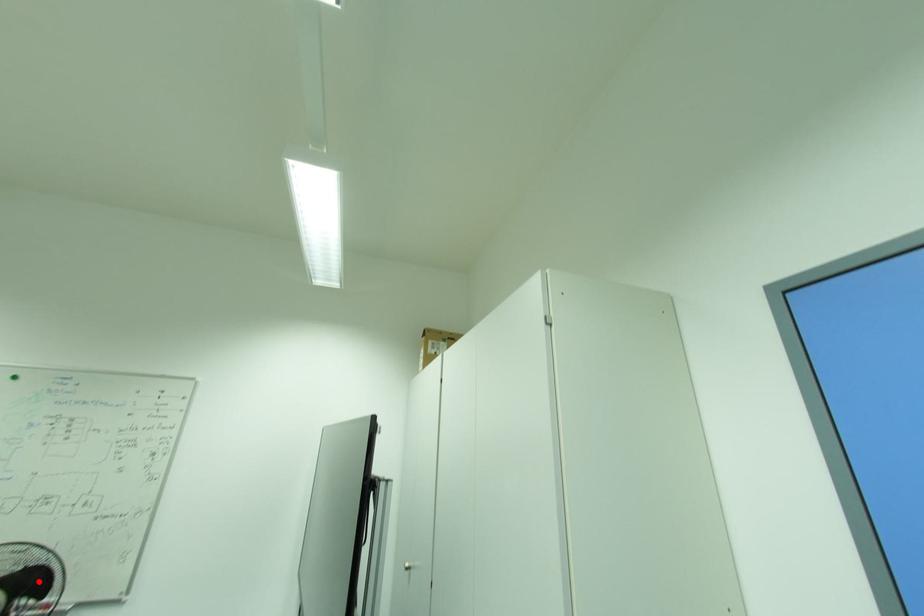
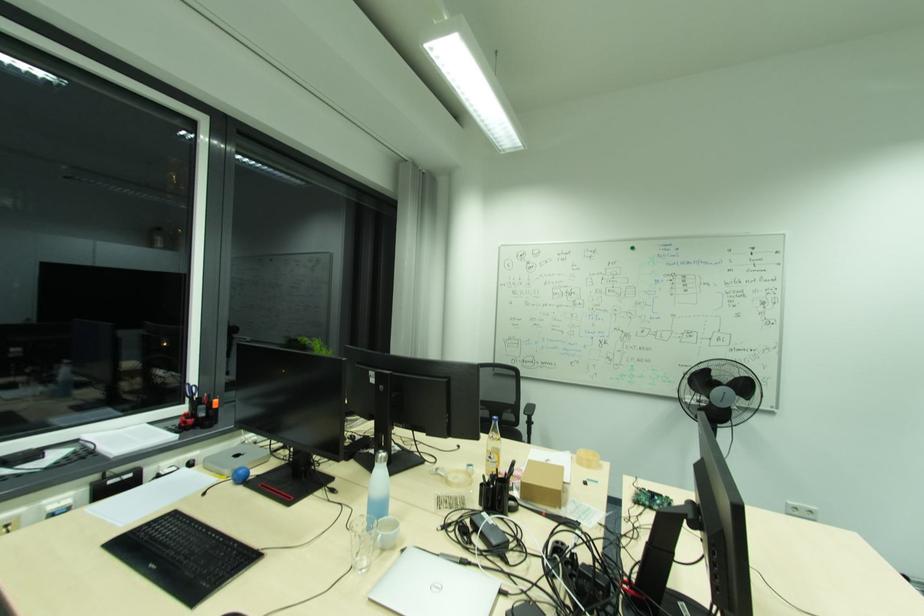
The point at the highlighted location is marked in the first image. Where is the corresponding point in the second image?

(748, 387)